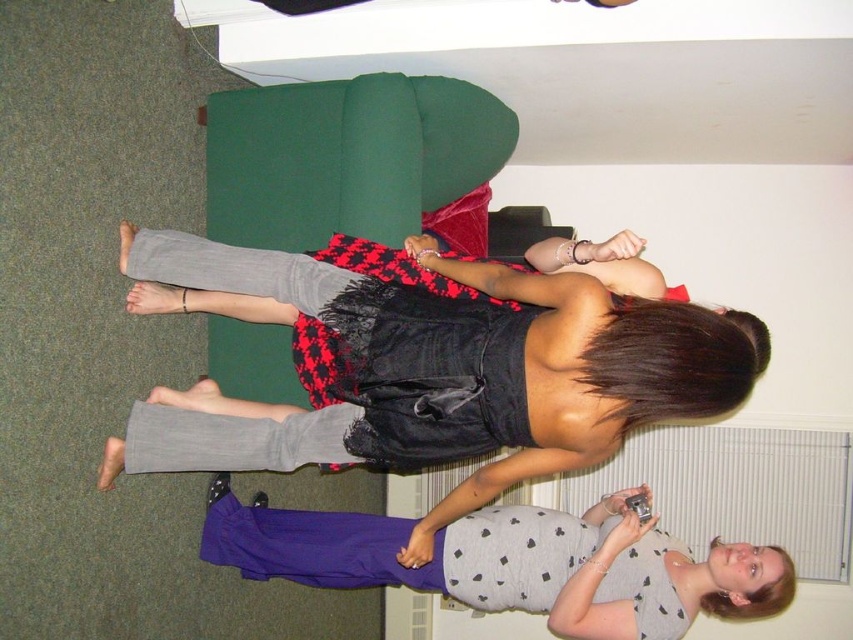
You are organizing a charity clothing drive and need to decide which items to donate based on size. Given the black satin dress at center and the gray dotted tank top at lower center, which one would you choose to donate if you prefer donating larger clothing items?

The black satin dress at center is bigger than the gray dotted tank top at lower center, so you should donate the black satin dress at center.

Please describe the position of the black satin dress at center in terms of its coordinates within the image frame.

The black satin dress at center is located at coordinates approximately 0.572 on the x axis and 0.513 on the y axis.